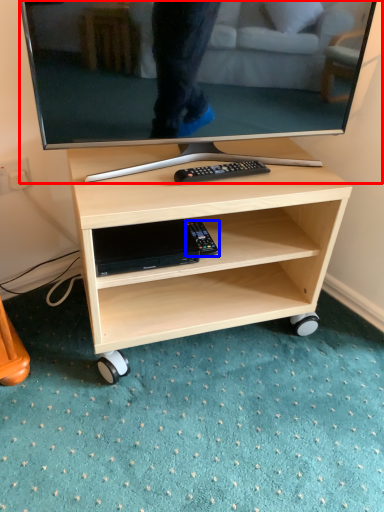
Question: Which object appears closest to the camera in this image, television (highlighted by a red box) or equipment (highlighted by a blue box)?

Choices:
 (A) television
 (B) equipment

Answer: (A)